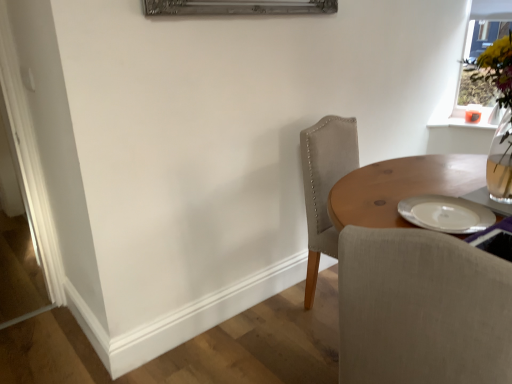
Measure the distance between point (483, 9) and camera.

Point (483, 9) and camera are 3.00 meters apart from each other.

Find the location of `transparent glass vase at upper right`. transparent glass vase at upper right is located at coordinates (486, 25).

Describe the element at coordinates (486, 25) in the screenshot. I see `transparent glass vase at upper right` at that location.

The height and width of the screenshot is (384, 512). What do you see at coordinates (422, 309) in the screenshot?
I see `light gray fabric chair at center` at bounding box center [422, 309].

Locate an element on the screen. light gray fabric chair at center is located at coordinates (422, 309).

The image size is (512, 384). What are the coordinates of `transparent glass vase at upper right` in the screenshot? It's located at (486, 25).

Is light gray fabric chair at center to the right of transparent glass vase at upper right from the viewer's perspective?

No.

Is light gray fabric chair at center in front of or behind transparent glass vase at upper right in the image?

light gray fabric chair at center is in front of transparent glass vase at upper right.

Which point is more distant from viewer, [343,371] or [443,100]?

The point [443,100] is behind.

From the image's perspective, does light gray fabric chair at center appear higher than transparent glass vase at upper right?

Incorrect, from the image's perspective, light gray fabric chair at center is lower than transparent glass vase at upper right.

From a real-world perspective, is light gray fabric chair at center positioned above or below transparent glass vase at upper right?

light gray fabric chair at center is situated lower than transparent glass vase at upper right in the real world.

Which of these two, light gray fabric chair at center or transparent glass vase at upper right, is wider?

With larger width is light gray fabric chair at center.

Based on the photo, considering the sizes of objects light gray fabric chair at center and transparent glass vase at upper right in the image provided, who is taller, light gray fabric chair at center or transparent glass vase at upper right?

light gray fabric chair at center is taller.

Based on the photo, who is smaller, light gray fabric chair at center or transparent glass vase at upper right?

transparent glass vase at upper right is smaller.

Is transparent glass vase at upper right surrounded by light gray fabric chair at center?

No.

Is light gray fabric chair at center not near transparent glass vase at upper right?

Indeed, light gray fabric chair at center is not near transparent glass vase at upper right.

Is light gray fabric chair at center turned away from transparent glass vase at upper right?

That's not correct — light gray fabric chair at center is not looking away from transparent glass vase at upper right.

How different are the orientations of light gray fabric chair at center and transparent glass vase at upper right in degrees?

The facing directions of light gray fabric chair at center and transparent glass vase at upper right are 171 degrees apart.

You are a GUI agent. You are given a task and a screenshot of the screen. Output one action in this format:
    pyautogui.click(x=<x>, y=<y>)
    Task: Click on the window that appears on the right of light gray fabric chair at center
    The height and width of the screenshot is (384, 512).
    Given the screenshot: What is the action you would take?
    pyautogui.click(x=486, y=25)

Between transparent glass vase at upper right and light gray fabric chair at center, which one appears on the right side from the viewer's perspective?

transparent glass vase at upper right.

Does transparent glass vase at upper right come behind light gray fabric chair at center?

Yes.

Is point (448, 106) less distant than point (387, 371)?

No, (448, 106) is further to viewer.

From the image's perspective, would you say transparent glass vase at upper right is shown under light gray fabric chair at center?

Actually, transparent glass vase at upper right appears above light gray fabric chair at center in the image.

From a real-world perspective, between transparent glass vase at upper right and light gray fabric chair at center, who is vertically higher?

transparent glass vase at upper right.

Between transparent glass vase at upper right and light gray fabric chair at center, which one has larger width?

light gray fabric chair at center is wider.

Considering the sizes of objects transparent glass vase at upper right and light gray fabric chair at center in the image provided, who is shorter, transparent glass vase at upper right or light gray fabric chair at center?

transparent glass vase at upper right is shorter.

Based on their sizes in the image, would you say transparent glass vase at upper right is bigger or smaller than light gray fabric chair at center?

transparent glass vase at upper right is smaller than light gray fabric chair at center.

Is transparent glass vase at upper right not inside light gray fabric chair at center?

Yes, transparent glass vase at upper right is not within light gray fabric chair at center.

Is transparent glass vase at upper right placed right next to light gray fabric chair at center?

No, transparent glass vase at upper right is not with light gray fabric chair at center.

Is transparent glass vase at upper right positioned with its back to light gray fabric chair at center?

No, transparent glass vase at upper right is not facing the opposite direction of light gray fabric chair at center.

Identify the location of window behind the light gray fabric chair at center. (486, 25).

The image size is (512, 384). What are the coordinates of `chair in front of the transparent glass vase at upper right` in the screenshot? It's located at (422, 309).

Find the location of a particular element. chair lying below the transparent glass vase at upper right (from the image's perspective) is located at coordinates (422, 309).